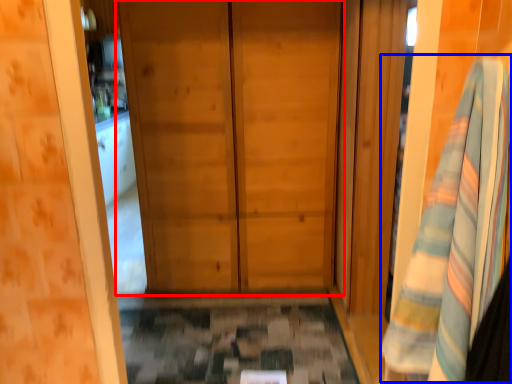
Question: Which point is further to the camera, door (highlighted by a red box) or bath towel (highlighted by a blue box)?

Choices:
 (A) door
 (B) bath towel

Answer: (A)